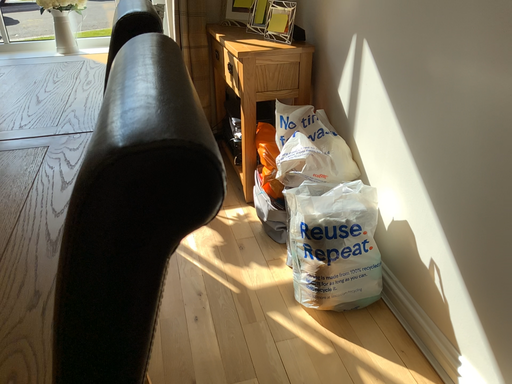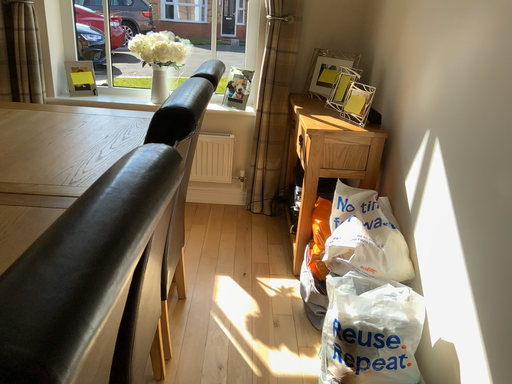
Question: How did the camera likely rotate when shooting the video?

Choices:
 (A) rotated upward
 (B) rotated downward

Answer: (A)